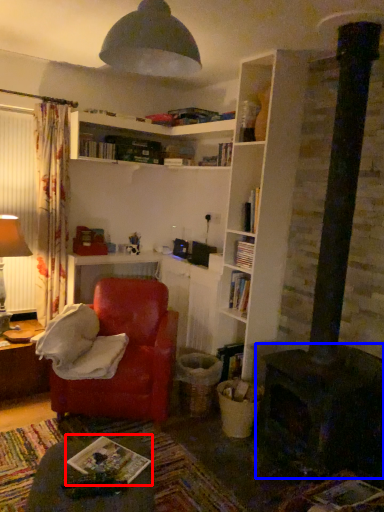
Question: Which of the following is the farthest to the observer, book (highlighted by a red box) or fireplace (highlighted by a blue box)?

Choices:
 (A) book
 (B) fireplace

Answer: (B)